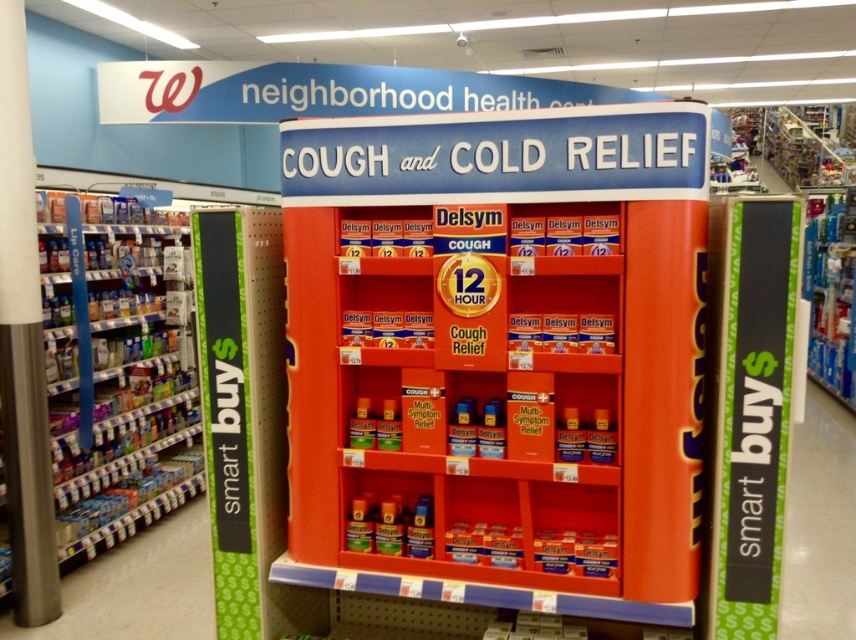
You are a customer in a Walgreens store and need to grab a cough syrup bottle from the matte plastic shelves at left. The green matte signboard at left has a QR code that you need to scan for a discount. Can you reach both items without moving more than 3 meters from your current position?

The distance between the matte plastic shelves at left and the green matte signboard at left is 2.52 meters. Since you need to move less than 3 meters to reach both items, you can grab the cough syrup bottle and scan the QR code without moving more than 3 meters from your current position.

You are standing in front of the Walgreens retail display for cough and cold relief products. You notice two points marked on the display. The first point is at coordinates point (756, 563) and the second is at point (189, 221). Which of these two points is closer to your viewpoint as you face the display?

Point (756, 563) is closer to the camera than point (189, 221), so the first point is closer to your viewpoint.